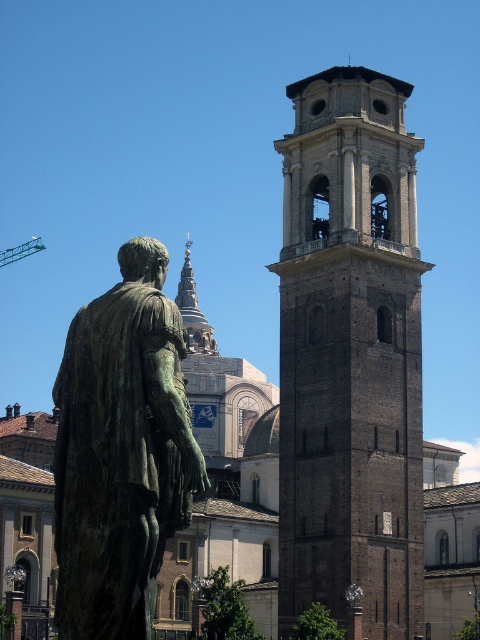
You are standing at the point marked as point (x=350, y=355) in the image. What object is exactly at your current location?

The brown brick tower at center is located at point (x=350, y=355).

You are standing in a square and want to take a photo of the brown brick tower at center. The camera you are using has a maximum focus range of 60 meters. Will the tower be in focus?

The brown brick tower at center is 61.70 meters from viewer. Since the camera can only focus up to 60 meters, the tower will be out of focus.